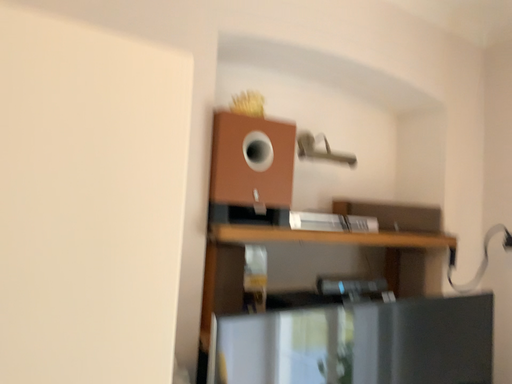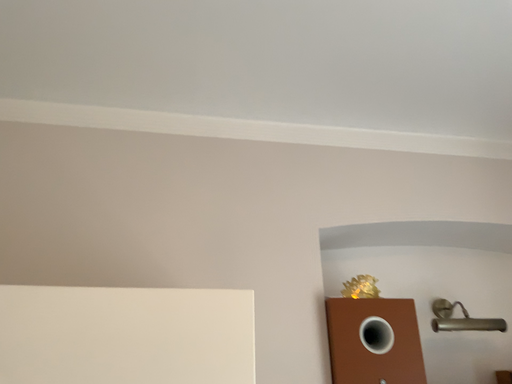
Question: How did the camera likely rotate when shooting the video?

Choices:
 (A) rotated left
 (B) rotated right

Answer: (A)